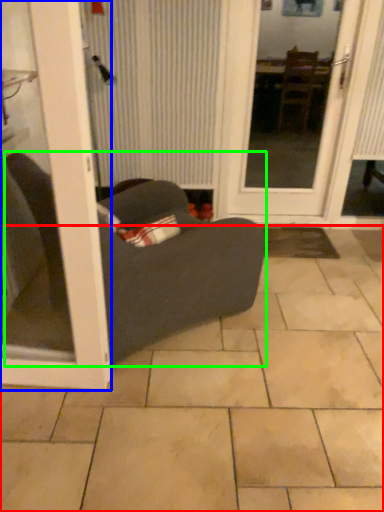
Question: Considering the real-world distances, which object is farthest from ceramic tile (highlighted by a red box)? door (highlighted by a blue box) or studio couch (highlighted by a green box)?

Choices:
 (A) door
 (B) studio couch

Answer: (A)